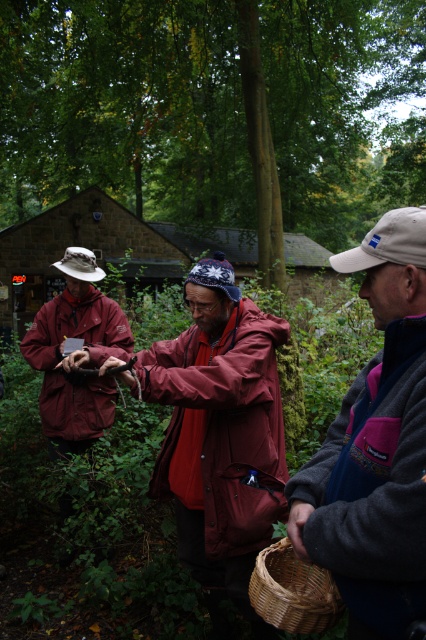
Question: Is maroon fabric jacket at center closer to camera compared to woven straw basket at lower center?

Choices:
 (A) yes
 (B) no

Answer: (B)

Question: Which object is the farthest from the red matte jacket at center?

Choices:
 (A) gray fleece jacket at center
 (B) woven straw basket at lower center
 (C) maroon fabric jacket at center

Answer: (A)

Question: Is gray fleece jacket at center wider than woven straw basket at lower center?

Choices:
 (A) no
 (B) yes

Answer: (B)

Question: Which point is farther to the camera?

Choices:
 (A) (71, 294)
 (B) (402, 618)
 (C) (290, 500)
 (D) (264, 369)

Answer: (A)

Question: Which of these objects is positioned farthest from the matte red jacket at left?

Choices:
 (A) gray fleece jacket at center
 (B) red matte jacket at center
 (C) maroon fabric jacket at center

Answer: (A)

Question: Can you confirm if matte maroon jacket at left is thinner than woven straw basket at lower center?

Choices:
 (A) yes
 (B) no

Answer: (B)